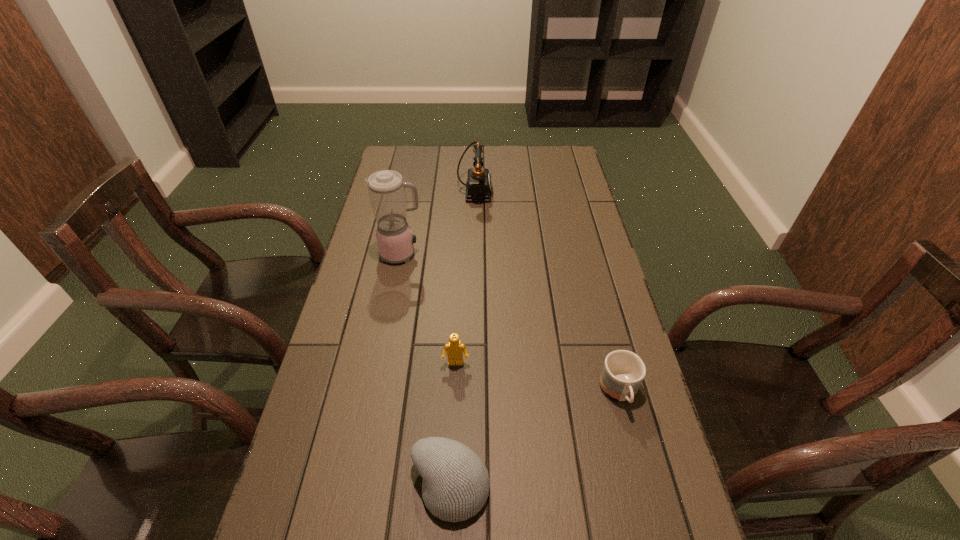
Image resolution: width=960 pixels, height=540 pixels. Find the location of `vacant space that satisfies the following two spatial constraints: 1. on the base of the fourth nearest object near the control knob; 2. on the right side of the nearest object`. vacant space that satisfies the following two spatial constraints: 1. on the base of the fourth nearest object near the control knob; 2. on the right side of the nearest object is located at coordinates (357, 486).